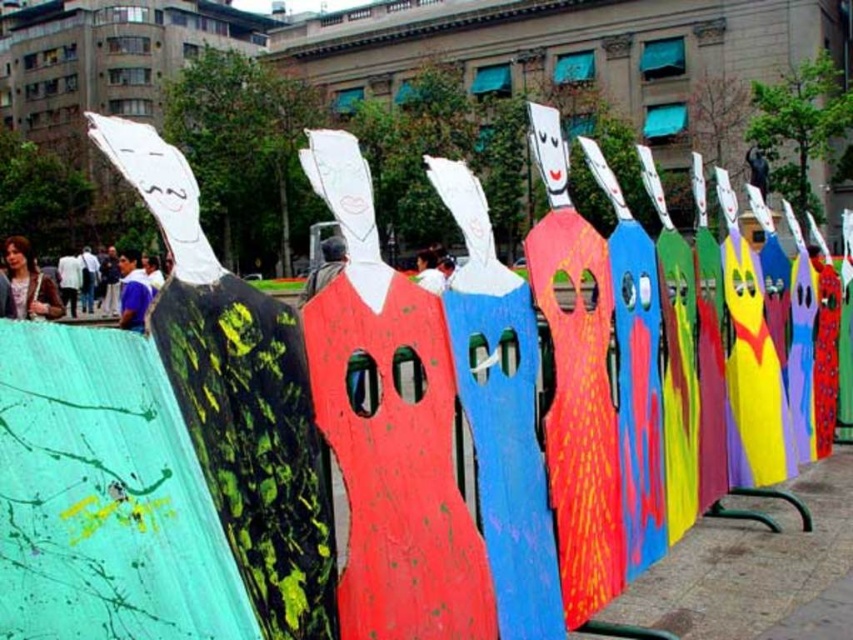
Looking at this image, you are an artist standing in front of the installation and want to hang a new sculpture between the matte gray jacket at center and the white cotton shirt at center. Based on their positions, where should you place the new sculpture?

The matte gray jacket at center is below the white cotton shirt at center, so you should place the new sculpture between them by positioning it above the matte gray jacket at center and below the white cotton shirt at center.

You are an artist observing the installation and notice the matte brown hair at left and the white cotton shirt at center. Which object is located above the other?

The matte brown hair at left is positioned over white cotton shirt at center, so it is above the other.